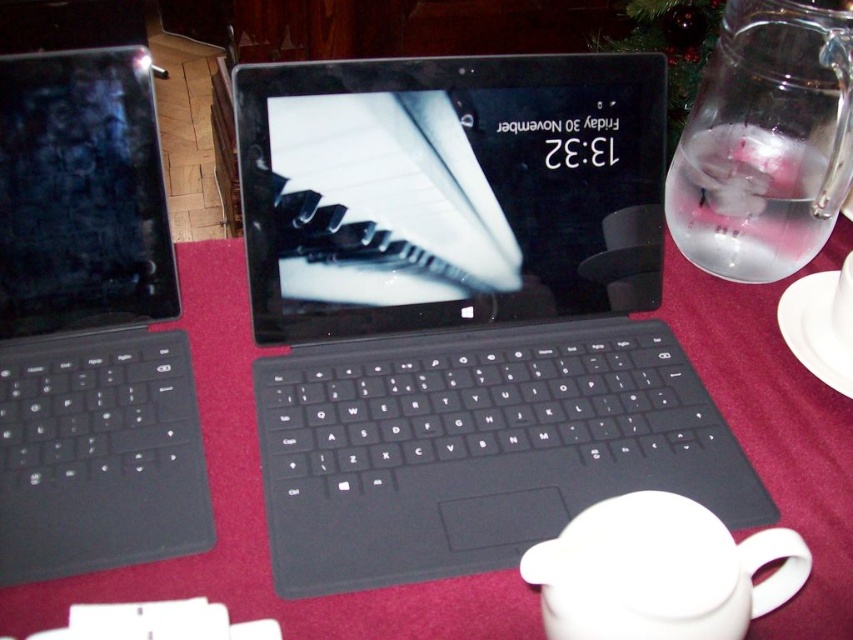
Question: Considering the real-world distances, which object is farthest from the black glossy tablet at left?

Choices:
 (A) white ceramic saucer at right
 (B) matte black laptop at left
 (C) white matte mug at center

Answer: (C)

Question: Which object is positioned farthest from the matte black tablet at center?

Choices:
 (A) white ceramic saucer at right
 (B) matte black laptop at left
 (C) red fabric tablecloth at center

Answer: (A)

Question: Can you confirm if matte black laptop at left is thinner than white ceramic saucer at right?

Choices:
 (A) no
 (B) yes

Answer: (A)

Question: Is black matte keyboard at center thinner than white matte mug at center?

Choices:
 (A) no
 (B) yes

Answer: (A)

Question: Which point is closer to the camera?

Choices:
 (A) black matte keyboard at center
 (B) white matte mug at lower right

Answer: (B)

Question: Can you confirm if matte black tablet at center is smaller than white matte mug at center?

Choices:
 (A) yes
 (B) no

Answer: (B)